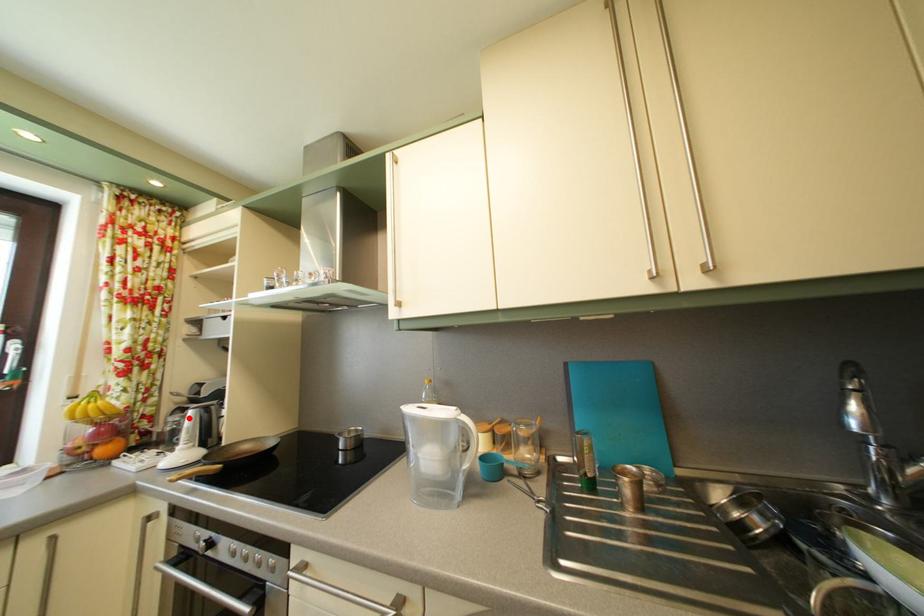
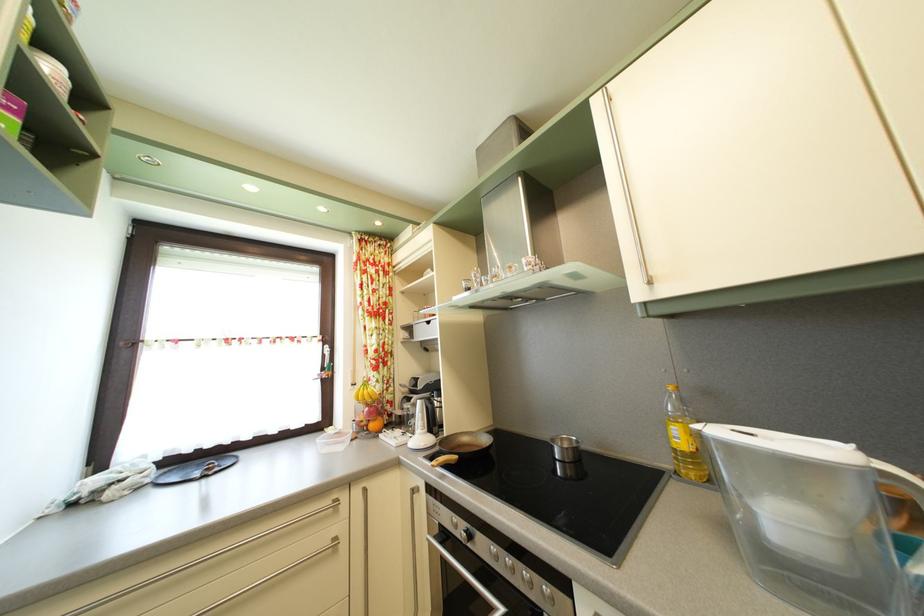
Where in the second image is the point corresponding to the highlighted location from the first image?

(417, 407)